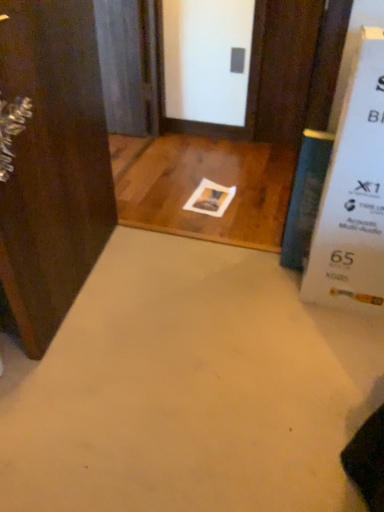
At what (x,y) coordinates should I click in order to perform the action: click on free location in front of dark wood door at left, marked as the second door in a right-to-left arrangement. Please return your answer as a coordinate pair (x, y). Image resolution: width=384 pixels, height=512 pixels. Looking at the image, I should click on point(96,384).